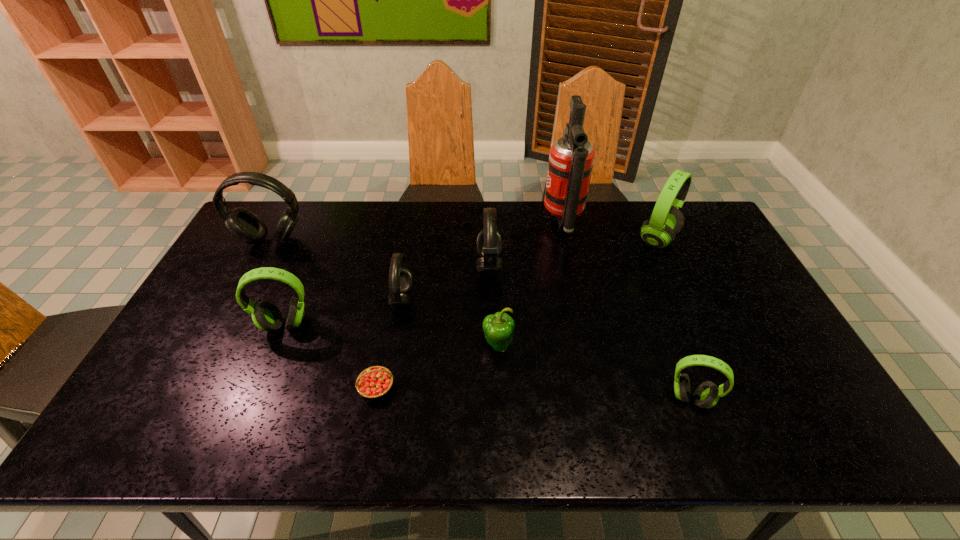
At what (x,y) coordinates should I click in order to perform the action: click on free region that satisfies the following two spatial constraints: 1. on the earcups of the second smallest green headset; 2. on the right side of the biggest gray headset. Please return your answer as a coordinate pair (x, y). The width and height of the screenshot is (960, 540). Looking at the image, I should click on (227, 325).